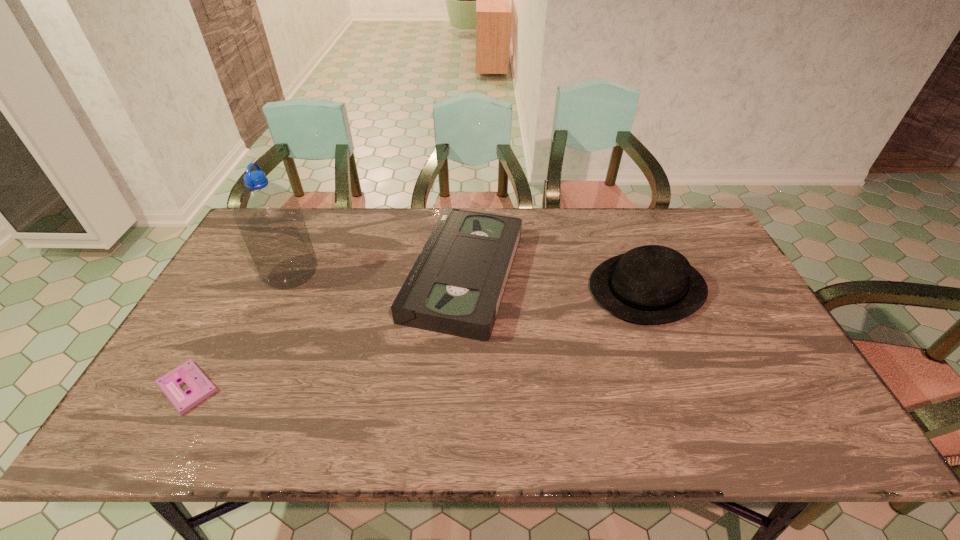
Find the location of a particular element. The width and height of the screenshot is (960, 540). water jug is located at coordinates (268, 216).

What are the coordinates of `fedora` in the screenshot? It's located at (652, 284).

Locate an element on the screen. Image resolution: width=960 pixels, height=540 pixels. the third shortest object is located at coordinates (652, 284).

The height and width of the screenshot is (540, 960). In order to click on the third object from left to right in this screenshot , I will do `click(455, 287)`.

Identify the location of the taller videotape. (455, 287).

This screenshot has height=540, width=960. What are the coordinates of `the nearer videotape` in the screenshot? It's located at (200, 387).

Locate an element on the screen. The width and height of the screenshot is (960, 540). the nearest object is located at coordinates (200, 387).

Identify the location of free space located 0.090m on the right of the water jug. This screenshot has height=540, width=960. (348, 274).

In order to click on vacant area situated on the back of the fedora in this screenshot , I will do (629, 241).

What are the coordinates of `free spot located on the front of the farther videotape` in the screenshot? It's located at (460, 384).